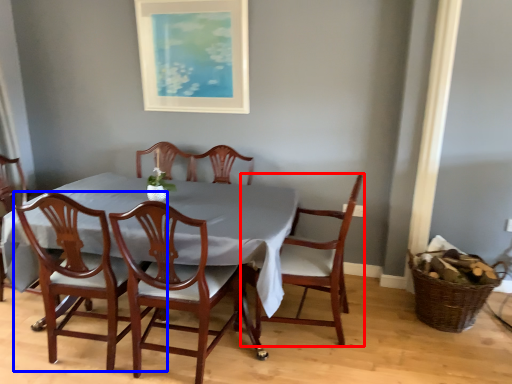
Question: Which of the following is the farthest to the observer, chair (highlighted by a red box) or chair (highlighted by a blue box)?

Choices:
 (A) chair
 (B) chair

Answer: (A)